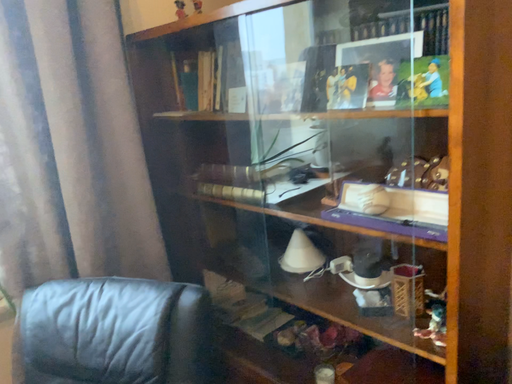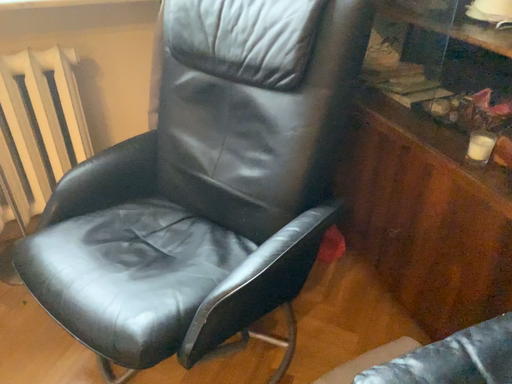
Question: Which way did the camera rotate in the video?

Choices:
 (A) rotated downward
 (B) rotated upward

Answer: (A)